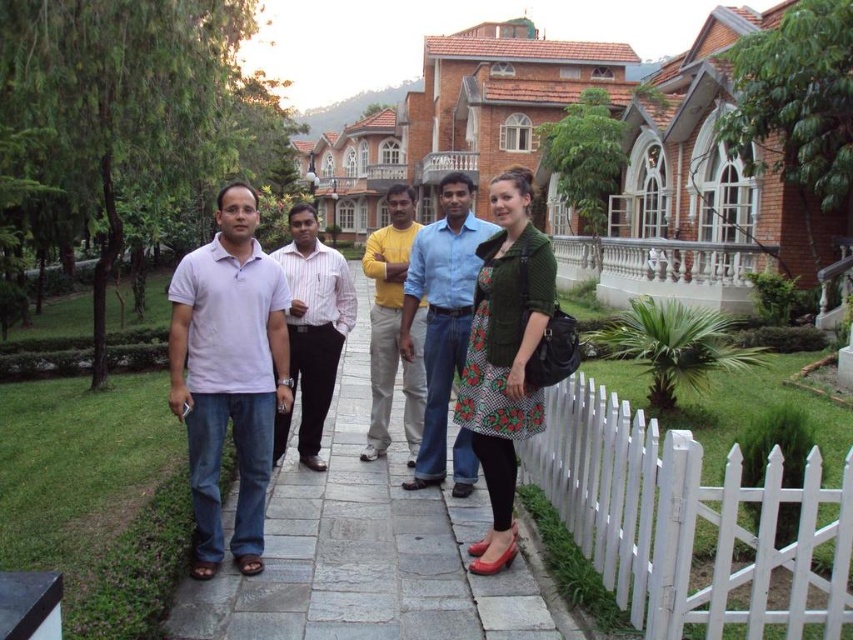
Question: Does gray stone pavement at center come in front of yellow cotton shirt at center?

Choices:
 (A) yes
 (B) no

Answer: (A)

Question: Does white matte shirt at center have a larger size compared to yellow cotton shirt at center?

Choices:
 (A) yes
 (B) no

Answer: (B)

Question: Does white matte shirt at center have a larger size compared to yellow cotton shirt at center?

Choices:
 (A) no
 (B) yes

Answer: (A)

Question: Which object is positioned closest to the striped cotton shirt at center?

Choices:
 (A) white wooden fence at lower right
 (B) yellow cotton shirt at center
 (C) white matte shirt at center

Answer: (C)

Question: Which of these objects is positioned closest to the yellow cotton shirt at center?

Choices:
 (A) white wooden fence at lower right
 (B) blue cotton shirt at center
 (C) striped cotton shirt at center
 (D) gray stone pavement at center

Answer: (C)

Question: Which object is closer to the camera taking this photo?

Choices:
 (A) white wooden fence at lower right
 (B) yellow cotton shirt at center
 (C) gray stone pavement at center

Answer: (A)